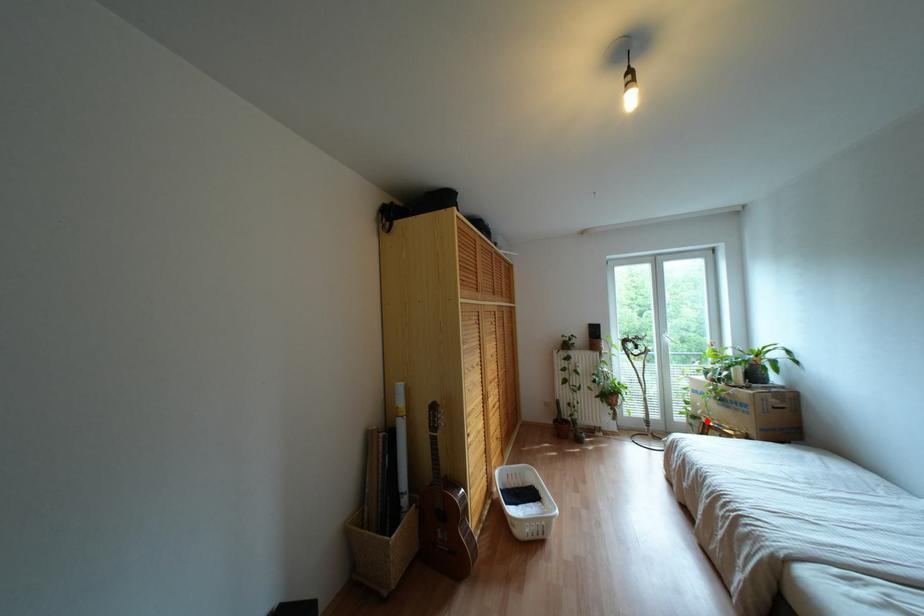
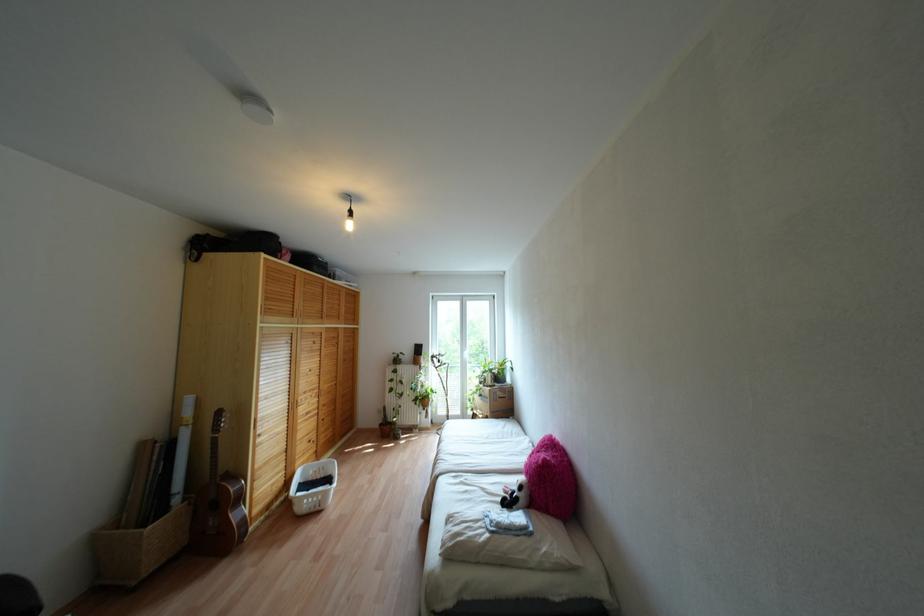
Locate, in the second image, the point that corresponds to the highlighted location in the first image.

(473, 411)